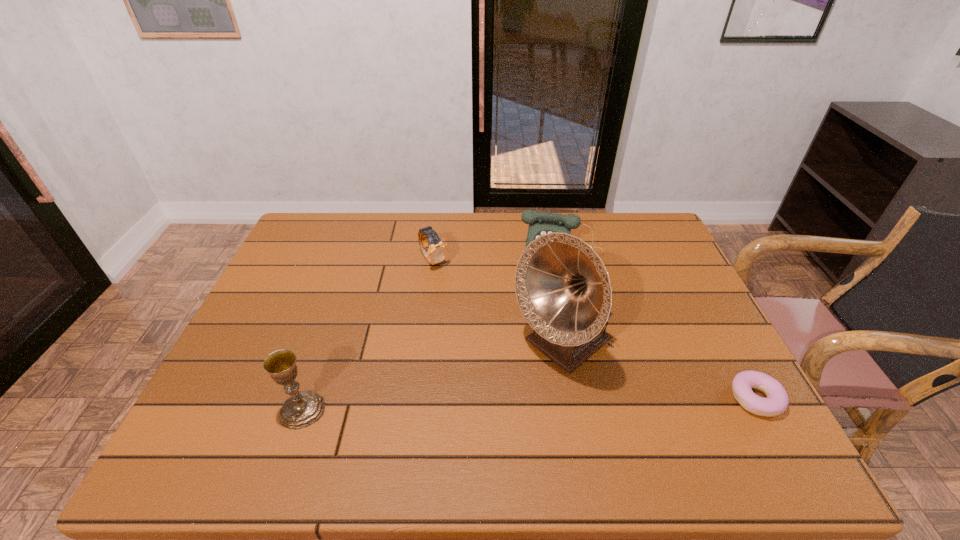
The width and height of the screenshot is (960, 540). Identify the location of free space located 0.240m on the face of the watch. (485, 319).

I want to click on free point located 0.230m on the face of the watch, so tap(483, 316).

Where is `free location located 0.330m on the face of the watch`? free location located 0.330m on the face of the watch is located at coordinates (505, 340).

What are the coordinates of `vacant space located on the horn of the phonograph record` in the screenshot? It's located at (494, 400).

This screenshot has height=540, width=960. I want to click on vacant space located 0.160m on the horn of the phonograph record, so click(478, 413).

Image resolution: width=960 pixels, height=540 pixels. Identify the location of free space located on the horn of the phonograph record. (510, 388).

Identify the location of free space located on the dial of the third shortest object. Image resolution: width=960 pixels, height=540 pixels. (555, 295).

Identify the location of free space located 0.250m on the dial of the third shortest object. pyautogui.click(x=551, y=334).

The height and width of the screenshot is (540, 960). I want to click on free space located on the dial of the third shortest object, so click(554, 307).

Where is `watch that is at the far edge`? watch that is at the far edge is located at coordinates (436, 252).